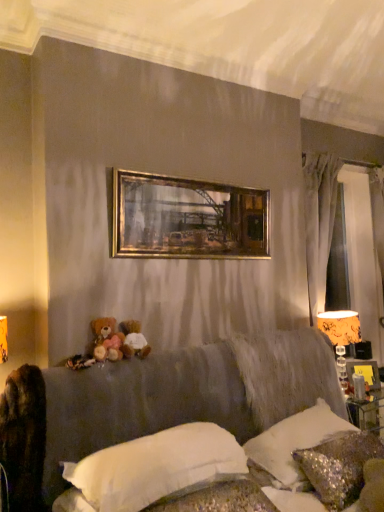
Question: Considering the relative sizes of gold metallic picture frame at upper center and sparkly silver pillow at lower right, placed as the 3th pillow when sorted from left to right, in the image provided, is gold metallic picture frame at upper center shorter than sparkly silver pillow at lower right, placed as the 3th pillow when sorted from left to right,?

Choices:
 (A) yes
 (B) no

Answer: (B)

Question: Can sparkly silver pillow at lower right, the 1th pillow from the right, be found inside gold metallic picture frame at upper center?

Choices:
 (A) no
 (B) yes

Answer: (A)

Question: From a real-world perspective, is gold metallic picture frame at upper center positioned over sparkly silver pillow at lower right, the 1th pillow from the right, based on gravity?

Choices:
 (A) no
 (B) yes

Answer: (B)

Question: Is gold metallic picture frame at upper center looking in the opposite direction of sparkly silver pillow at lower right, the 1th pillow from the right?

Choices:
 (A) yes
 (B) no

Answer: (B)

Question: Does gold metallic picture frame at upper center lie behind sparkly silver pillow at lower right, placed as the 3th pillow when sorted from left to right?

Choices:
 (A) no
 (B) yes

Answer: (B)

Question: Is gold metallic picture frame at upper center at the right side of sparkly silver pillow at lower right, the 1th pillow from the right?

Choices:
 (A) yes
 (B) no

Answer: (B)

Question: From a real-world perspective, is satin sequined pillow at lower right, which is the 2th pillow in right-to-left order, located higher than sparkly silver pillow at lower right, placed as the 3th pillow when sorted from left to right?

Choices:
 (A) yes
 (B) no

Answer: (A)

Question: Are satin sequined pillow at lower right, arranged as the second pillow when viewed from the left, and sparkly silver pillow at lower right, placed as the 3th pillow when sorted from left to right, located far from each other?

Choices:
 (A) yes
 (B) no

Answer: (B)

Question: From a real-world perspective, is satin sequined pillow at lower right, which is the 2th pillow in right-to-left order, below sparkly silver pillow at lower right, placed as the 3th pillow when sorted from left to right?

Choices:
 (A) yes
 (B) no

Answer: (B)

Question: Is satin sequined pillow at lower right, which is the 2th pillow in right-to-left order, positioned in front of sparkly silver pillow at lower right, placed as the 3th pillow when sorted from left to right?

Choices:
 (A) yes
 (B) no

Answer: (B)

Question: Is satin sequined pillow at lower right, which is the 2th pillow in right-to-left order, oriented towards sparkly silver pillow at lower right, placed as the 3th pillow when sorted from left to right?

Choices:
 (A) no
 (B) yes

Answer: (B)

Question: Is sparkly silver pillow at lower right, the 1th pillow from the right, at the back of satin sequined pillow at lower right, which is the 2th pillow in right-to-left order?

Choices:
 (A) no
 (B) yes

Answer: (A)

Question: From a real-world perspective, is gold metallic picture frame at upper center positioned over orange fabric lampshade at right based on gravity?

Choices:
 (A) yes
 (B) no

Answer: (A)